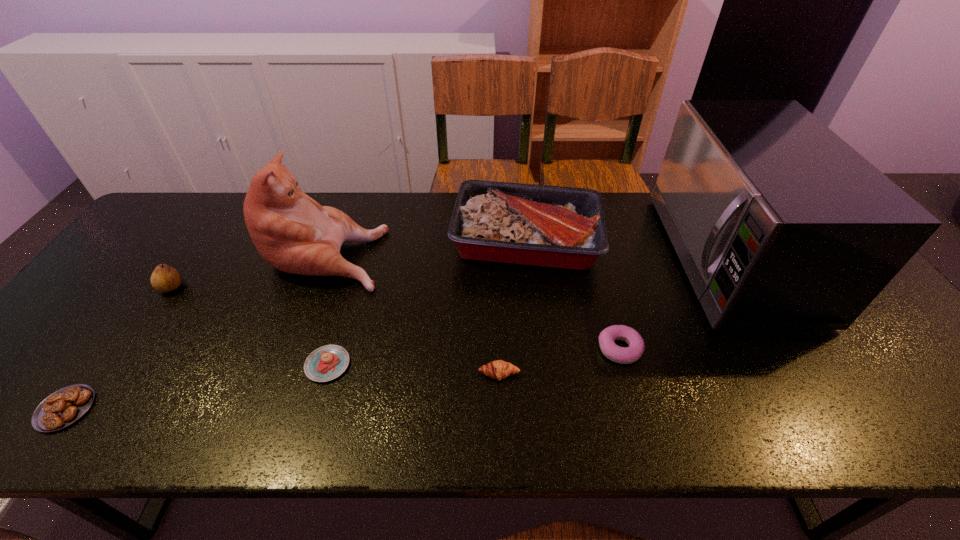
Identify which object is the second nearest to the rightmost object. Please provide its 2D coordinates. Your answer should be formatted as a tuple, i.e. [(x, y)], where the tuple contains the x and y coordinates of a point satisfying the conditions above.

[(551, 226)]

Identify which pastry is the second closest to the third pastry from right to left. Please provide its 2D coordinates. Your answer should be formatted as a tuple, i.e. [(x, y)], where the tuple contains the x and y coordinates of a point satisfying the conditions above.

[(65, 406)]

This screenshot has width=960, height=540. In order to click on pastry that stands as the closest to the rightmost pastry in this screenshot , I will do `click(498, 369)`.

Locate an element on the screen. vacant position in the image that satisfies the following two spatial constraints: 1. with the door open on the rightmost object; 2. on the front-facing side of the third pastry from left to right is located at coordinates (795, 374).

Image resolution: width=960 pixels, height=540 pixels. What are the coordinates of `vacant position in the image that satisfies the following two spatial constraints: 1. on the face of the cat; 2. on the left side of the third pastry from right to left` in the screenshot? It's located at (286, 364).

Where is `vacant region that satisfies the following two spatial constraints: 1. on the back side of the third tallest object; 2. on the right side of the third pastry from right to left`? The image size is (960, 540). vacant region that satisfies the following two spatial constraints: 1. on the back side of the third tallest object; 2. on the right side of the third pastry from right to left is located at coordinates (364, 240).

Locate an element on the screen. vacant space that satisfies the following two spatial constraints: 1. on the face of the cat; 2. on the back side of the rightmost pastry is located at coordinates (292, 349).